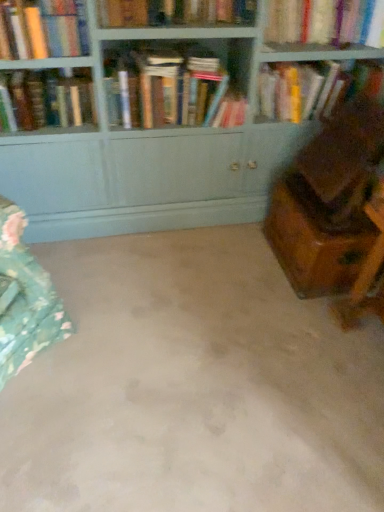
Where is `free space in front of wooden chest at right`? free space in front of wooden chest at right is located at coordinates (307, 325).